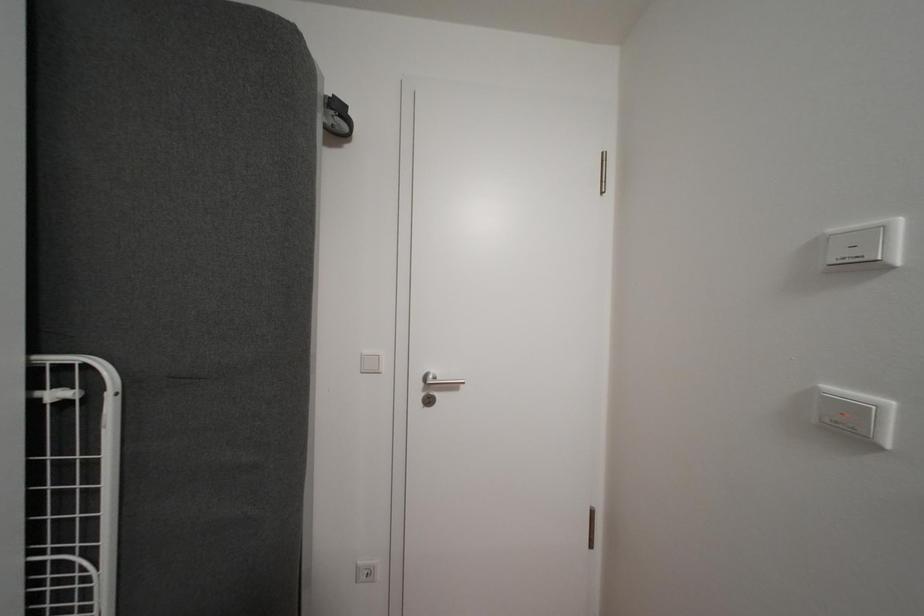
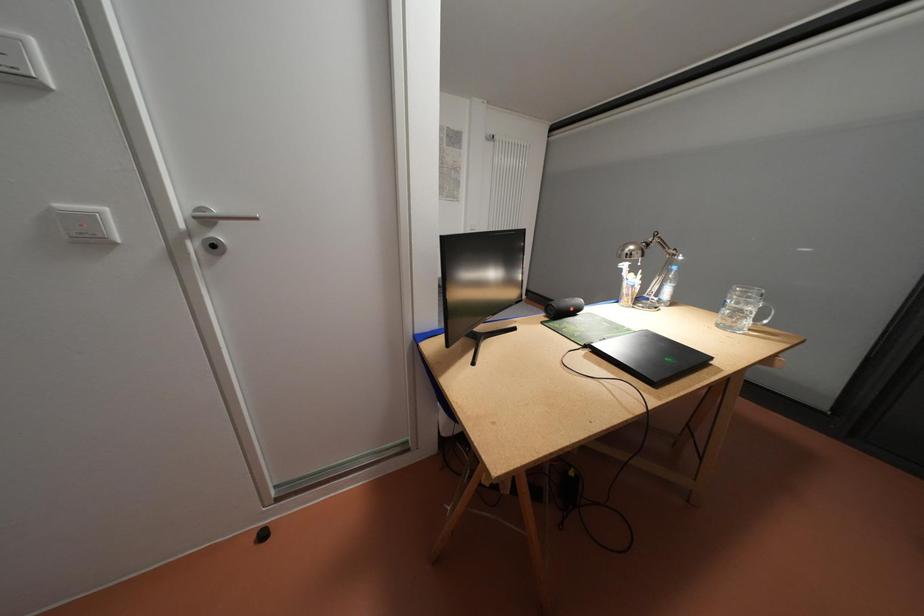
How did the camera likely rotate?

The camera rotated toward right-down.